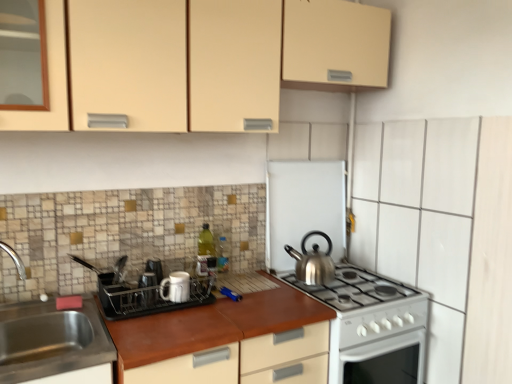
You are a GUI agent. You are given a task and a screenshot of the screen. Output one action in this format:
    pyautogui.click(x=<x>, y=<y>)
    Task: Click on the vacant space in front of white matte dish rack at center, which appears as the first appliance when viewed from the front
    The image size is (512, 384).
    Given the screenshot: What is the action you would take?
    pyautogui.click(x=159, y=334)